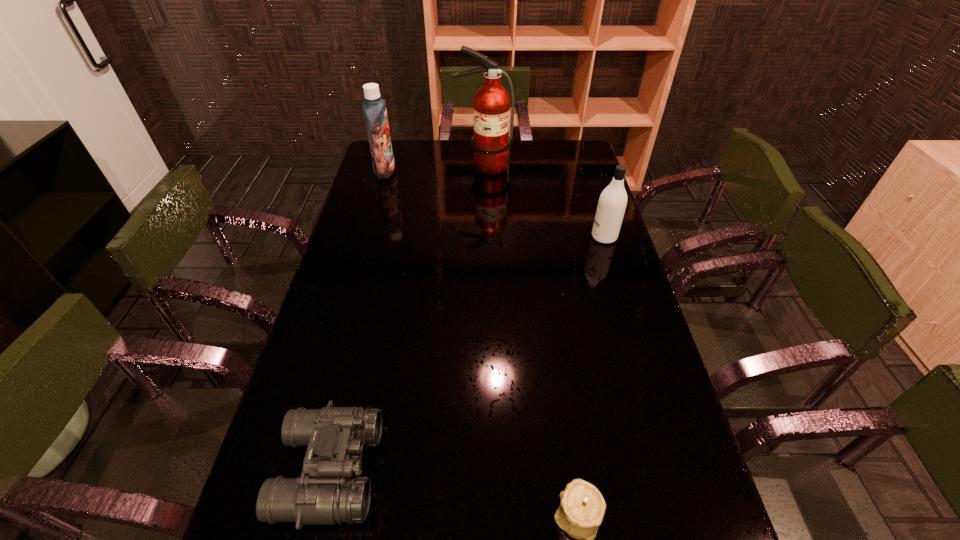
This screenshot has height=540, width=960. I want to click on free space at the left edge of the desktop, so click(x=328, y=301).

This screenshot has height=540, width=960. In order to click on free spot at the right edge of the desktop in this screenshot , I will do `click(588, 194)`.

Find the location of `vacant area at the far right corner`. vacant area at the far right corner is located at coordinates (558, 160).

The height and width of the screenshot is (540, 960). Find the location of `free spot between the farther shampoo and the third nearest object`. free spot between the farther shampoo and the third nearest object is located at coordinates (494, 204).

The height and width of the screenshot is (540, 960). Identify the location of free point between the fire extinguisher and the binoculars. (406, 318).

You are a GUI agent. You are given a task and a screenshot of the screen. Output one action in this format:
    pyautogui.click(x=<x>, y=<y>)
    Task: Click on the vacant region between the taller shampoo and the right shampoo
    The height and width of the screenshot is (540, 960).
    Given the screenshot: What is the action you would take?
    pyautogui.click(x=494, y=204)

Find the location of a particular element. blank region between the tallest object and the shorter shampoo is located at coordinates (543, 201).

Identify the location of free area in between the farther shampoo and the binoculars. The height and width of the screenshot is (540, 960). (357, 320).

Where is `free space between the tallest object and the left shampoo`? This screenshot has height=540, width=960. free space between the tallest object and the left shampoo is located at coordinates (434, 168).

Find the location of a particular element. This screenshot has height=540, width=960. object that can be found as the fourth closest to the right shampoo is located at coordinates (325, 494).